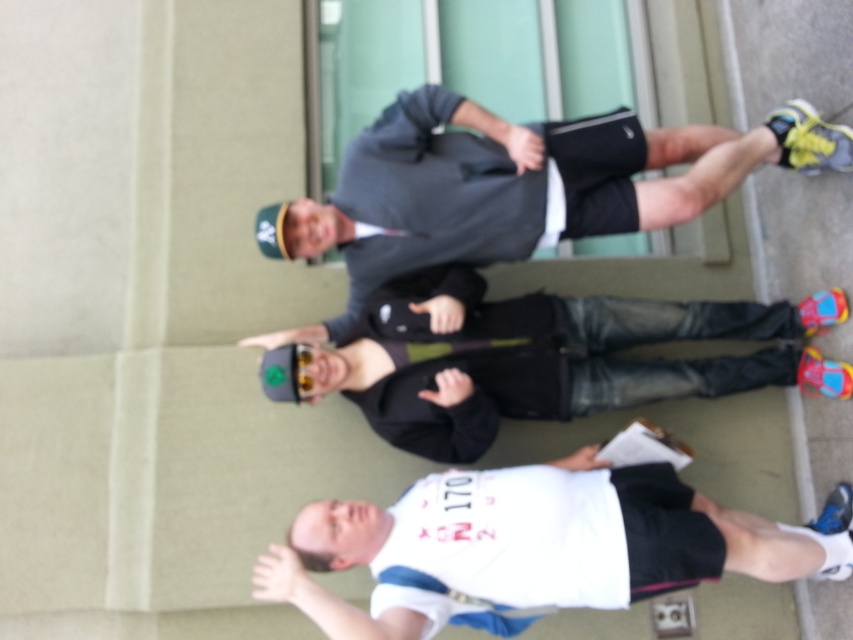
You are standing in a group photo and notice two jackets in the image. The dark gray jacket at upper center and the black leather jacket at center. Which jacket appears taller in the photo?

The dark gray jacket at upper center is taller than the black leather jacket at center.

You are standing in the same location as the photographer and want to hand a document to the dark gray jacket at upper center and the black leather jacket at center. Which individual should you approach first based on their proximity to you?

You should approach the dark gray jacket at upper center first because it is closer to you than the black leather jacket at center, which is further away.

You are standing in the scene and want to move from point A to point B. Point A is located at coordinates point (535, 202) and point B is at point (442, 452). Which point should you start at to reach the other without walking away from the camera?

You should start at point (535, 202) because it is closer to the camera than point (442, 452), so moving from there towards point B would mean walking towards the camera, not away.